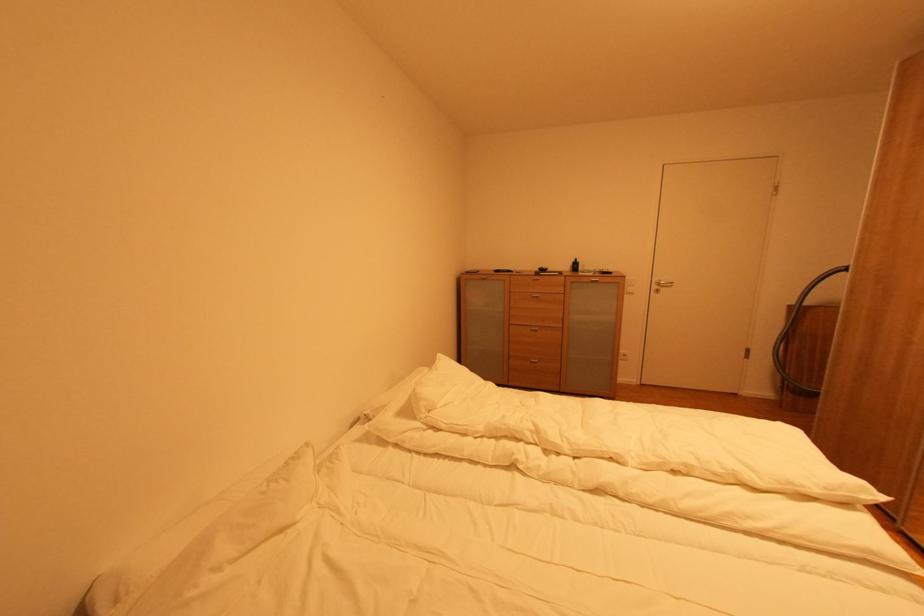
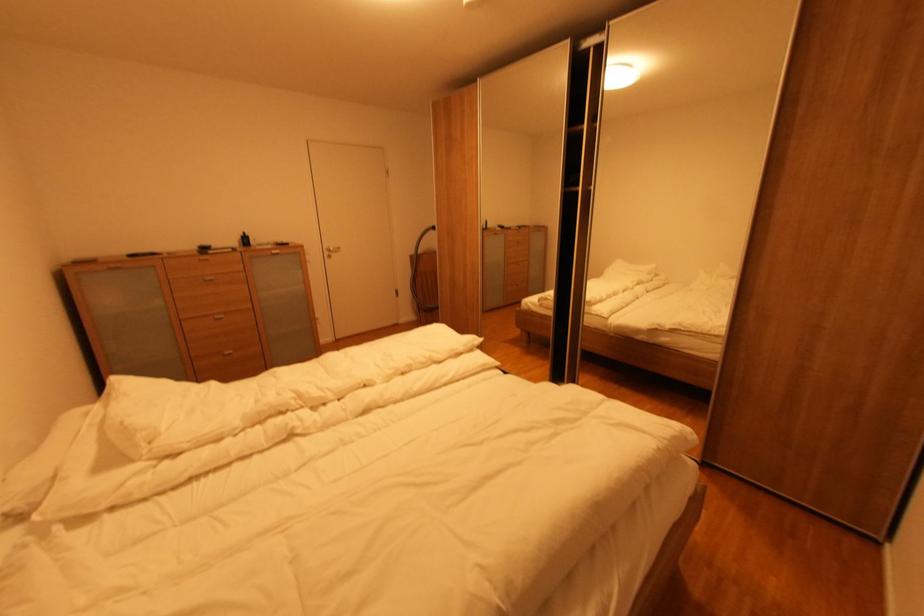
Question: The camera is either moving clockwise (left) or counter-clockwise (right) around the object. The first image is from the beginning of the video and the second image is from the end. Is the camera moving left or right when shooting the video?

Choices:
 (A) Left
 (B) Right

Answer: (A)